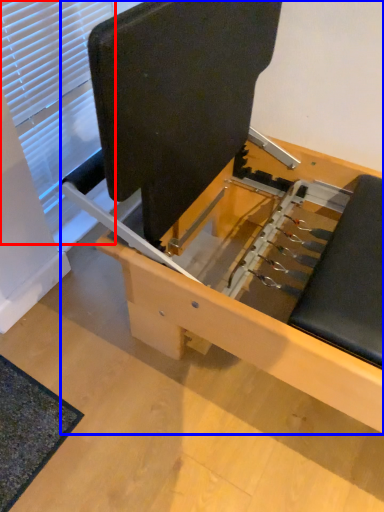
Question: Which object appears closest to the camera in this image, window (highlighted by a red box) or furniture (highlighted by a blue box)?

Choices:
 (A) window
 (B) furniture

Answer: (B)